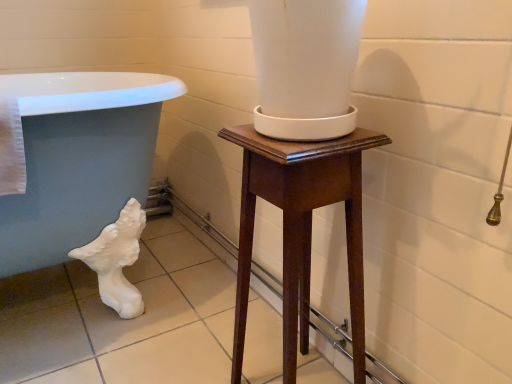
Question: Is white glossy bath at lower left aimed at mahogany wood pedestal at center?

Choices:
 (A) no
 (B) yes

Answer: (B)

Question: Does white glossy bath at lower left have a lesser height compared to mahogany wood pedestal at center?

Choices:
 (A) no
 (B) yes

Answer: (A)

Question: Is white glossy bath at lower left positioned far away from mahogany wood pedestal at center?

Choices:
 (A) yes
 (B) no

Answer: (B)

Question: Considering the relative sizes of white glossy bath at lower left and mahogany wood pedestal at center in the image provided, is white glossy bath at lower left smaller than mahogany wood pedestal at center?

Choices:
 (A) no
 (B) yes

Answer: (A)

Question: Can you confirm if white glossy bath at lower left is thinner than mahogany wood pedestal at center?

Choices:
 (A) yes
 (B) no

Answer: (B)

Question: Considering the relative sizes of white glossy bath at lower left and mahogany wood pedestal at center in the image provided, is white glossy bath at lower left bigger than mahogany wood pedestal at center?

Choices:
 (A) no
 (B) yes

Answer: (B)

Question: Is mahogany wood pedestal at center positioned with its back to white glossy bath at lower left?

Choices:
 (A) no
 (B) yes

Answer: (A)

Question: Is mahogany wood pedestal at center positioned behind white glossy bath at lower left?

Choices:
 (A) yes
 (B) no

Answer: (B)

Question: Can we say mahogany wood pedestal at center lies outside white glossy bath at lower left?

Choices:
 (A) yes
 (B) no

Answer: (A)

Question: From a real-world perspective, is mahogany wood pedestal at center physically above white glossy bath at lower left?

Choices:
 (A) yes
 (B) no

Answer: (B)

Question: Can you confirm if mahogany wood pedestal at center is taller than white glossy bath at lower left?

Choices:
 (A) yes
 (B) no

Answer: (B)

Question: From the image's perspective, is mahogany wood pedestal at center above white glossy bath at lower left?

Choices:
 (A) yes
 (B) no

Answer: (B)

Question: In the image, is white glossy bath at lower left on the left side or the right side of mahogany wood pedestal at center?

Choices:
 (A) left
 (B) right

Answer: (A)